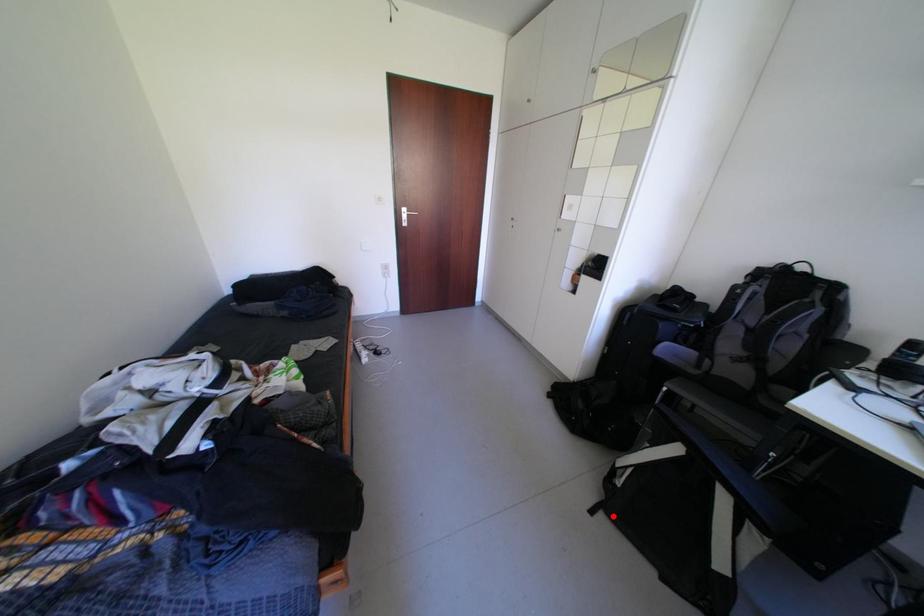
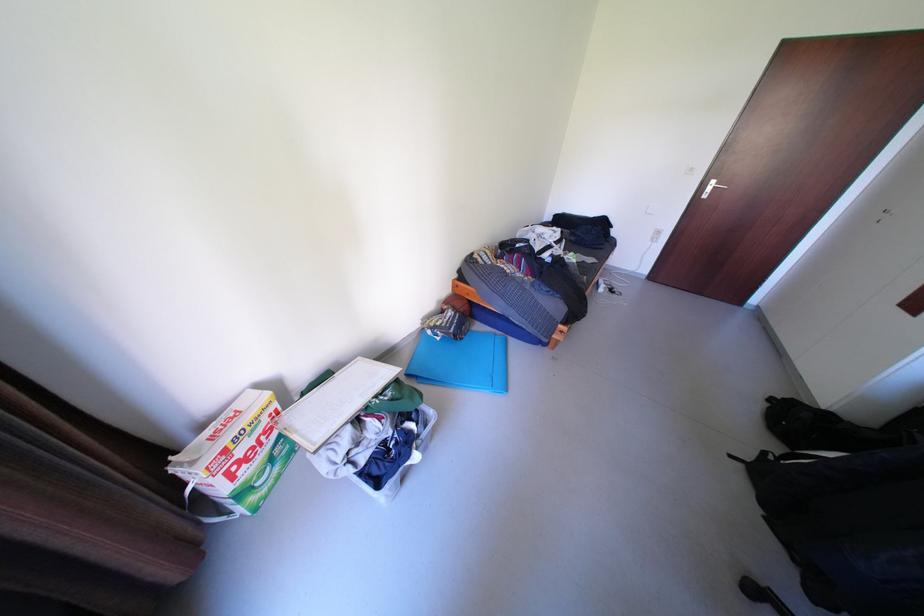
In the second image, find the point that corresponds to the highlighted location in the first image.

(752, 466)